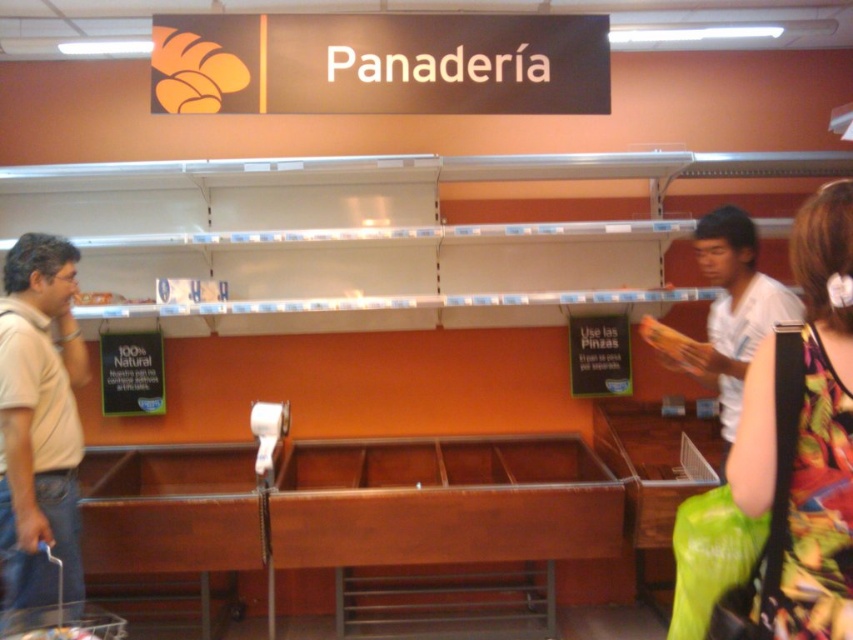
Does floral fabric dress at lower right appear on the left side of beige cotton shirt at left?

Incorrect, floral fabric dress at lower right is not on the left side of beige cotton shirt at left.

Which is in front, point (824, 461) or point (9, 472)?

Point (824, 461) is in front.

Image resolution: width=853 pixels, height=640 pixels. What are the coordinates of `floral fabric dress at lower right` in the screenshot? It's located at (804, 435).

Does beige cotton shirt at left appear under white cotton shirt at right?

Correct, beige cotton shirt at left is located below white cotton shirt at right.

Can you confirm if beige cotton shirt at left is positioned to the right of white cotton shirt at right?

In fact, beige cotton shirt at left is to the left of white cotton shirt at right.

Which is behind, point (50, 524) or point (746, 241)?

The point (746, 241) is behind.

Find the location of a particular element. This screenshot has width=853, height=640. beige cotton shirt at left is located at coordinates (39, 422).

The height and width of the screenshot is (640, 853). What do you see at coordinates (804, 435) in the screenshot?
I see `floral fabric dress at lower right` at bounding box center [804, 435].

From the picture: Is floral fabric dress at lower right positioned at the back of white cotton shirt at right?

No, it is not.

Who is more distant from viewer, (802,628) or (709,227)?

Positioned behind is point (709,227).

Locate an element on the screen. floral fabric dress at lower right is located at coordinates (804, 435).